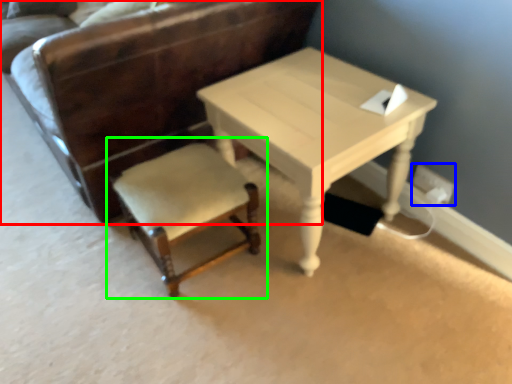
Question: Based on their relative distances, which object is nearer to chair (highlighted by a red box)? Choose from electric outlet (highlighted by a blue box) and chair (highlighted by a green box).

Choices:
 (A) electric outlet
 (B) chair

Answer: (B)